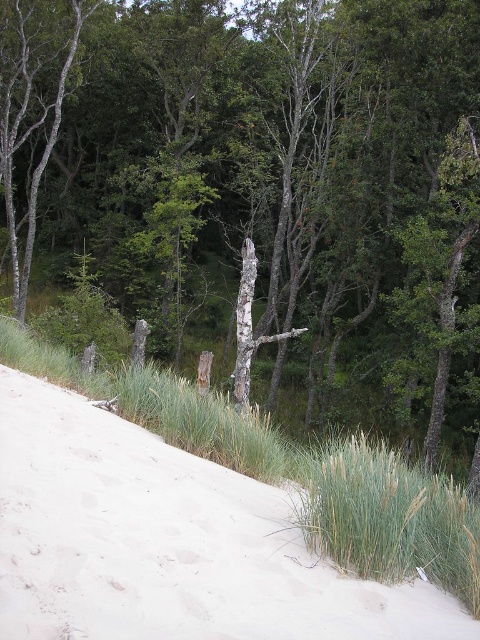
Who is more forward, (211, 406) or (242, 276)?

Point (211, 406)

Can you confirm if green grass at lower left is taller than gray bark tree trunk at center?

Yes.

What do you see at coordinates (296, 472) in the screenshot? This screenshot has height=640, width=480. I see `green grass at lower left` at bounding box center [296, 472].

The image size is (480, 640). In order to click on green grass at lower left in this screenshot , I will do `click(296, 472)`.